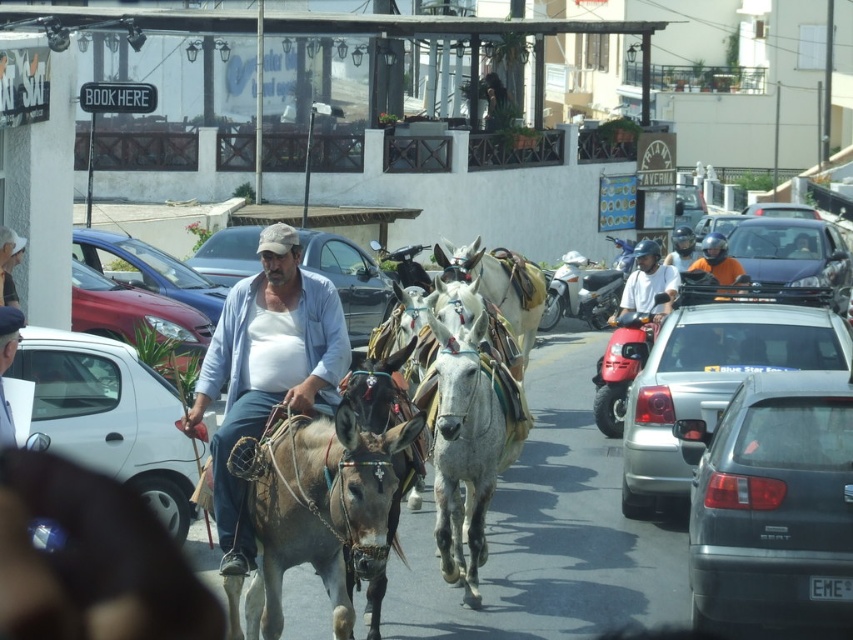
You are a pedestrian standing on the street and see the shiny black sedan at center and the metallic silver sedan at left. Which sedan is nearer to you?

The shiny black sedan at center is closer to the viewer than the metallic silver sedan at left.

You are standing at the center of the street and see the metallic blue sedan at center. If you walk straight ahead, will you reach the sedan before the road curves to the right?

The metallic blue sedan at center is located at point (349, 280), so yes, walking straight ahead would lead you to the sedan before the road curves to the right.